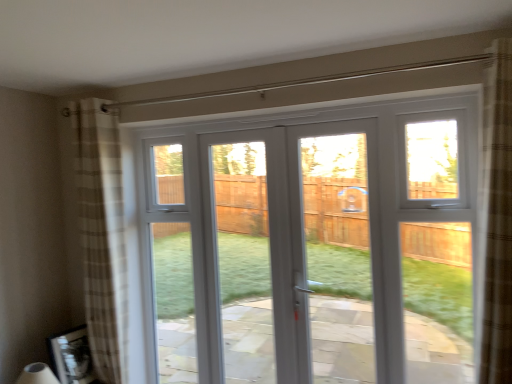
Question: Considering the relative positions of white plastic door at center and white plastic window at center in the image provided, is white plastic door at center to the left or to the right of white plastic window at center?

Choices:
 (A) left
 (B) right

Answer: (B)

Question: Is point (256, 286) closer or farther from the camera than point (385, 132)?

Choices:
 (A) farther
 (B) closer

Answer: (A)

Question: Which object is the farthest from the white plastic door at center?

Choices:
 (A) white plastic window at center
 (B) plaid fabric curtain at left

Answer: (B)

Question: Which object is the closest to the plaid fabric curtain at left?

Choices:
 (A) white plastic door at center
 (B) white plastic window at center

Answer: (B)